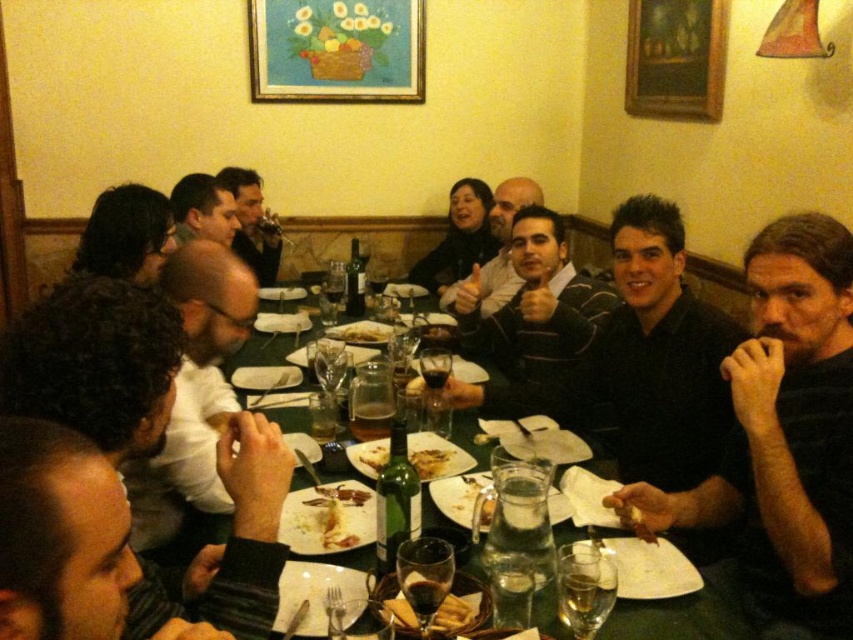
You are a server at the restaurant and need to place a new dish at the center of the table. However, there is an existing item at point [253,224]. What is the item located at that point?

The item at point [253,224] is a smooth black shirt at center.

You are a server at the restaurant and need to place a new dish on the table. The dish requires a spot that is taller than the slightly browned bread at center. Can you use the space where the smooth black shirt at center is located?

Yes, the smooth black shirt at center has a greater height compared to the slightly browned bread at center, so the space where the smooth black shirt at center is located meets the requirement.

You are a waiter at the restaurant and need to place a new dish that is 12 inches wide on the table. The dish must be placed between the black matte shirt at upper right and the slightly browned bread at center. Can you fit it there?

The black matte shirt at upper right might be wider than slightly browned bread at center, so the distance between them is uncertain. Without knowing the exact space, it is not possible to determine if the 12 inch dish will fit there.